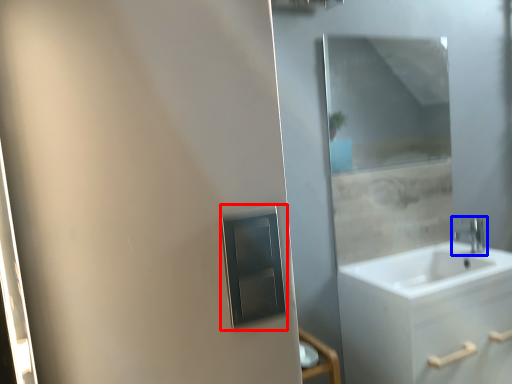
Question: Which of the following is the closest to the observer, medicine cabinet (highlighted by a red box) or tap (highlighted by a blue box)?

Choices:
 (A) medicine cabinet
 (B) tap

Answer: (A)